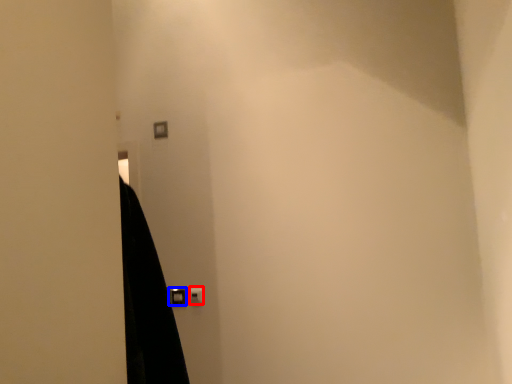
Question: Which object appears farthest to the camera in this image, light switch (highlighted by a red box) or door handle (highlighted by a blue box)?

Choices:
 (A) light switch
 (B) door handle

Answer: (B)